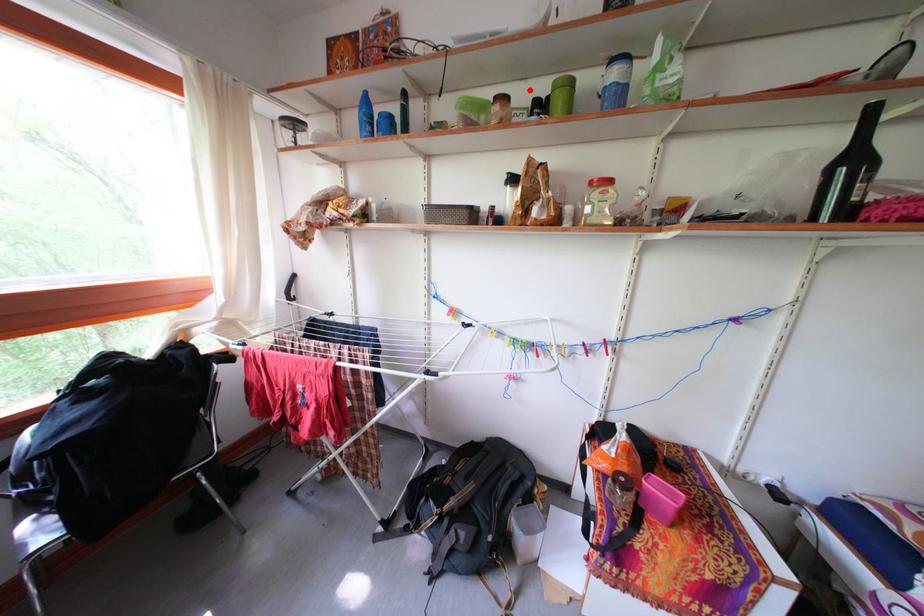
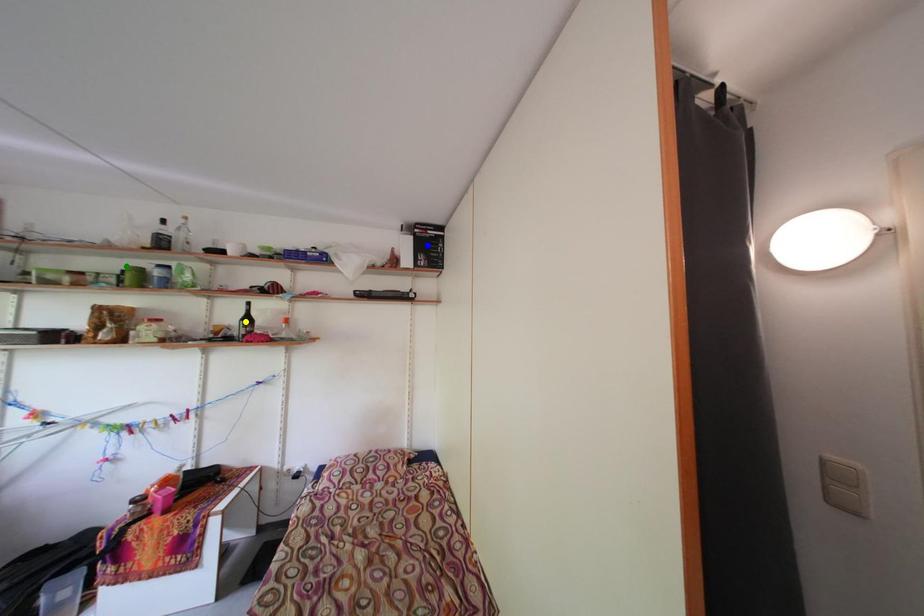
Question: I am providing you with two images of the same scene from different viewpoints. A red point is marked on the first image. You are given multiple points on the second image. Which spot in image 2 lines up with the point in image 1?

Choices:
 (A) yellow point
 (B) green point
 (C) blue point

Answer: (B)